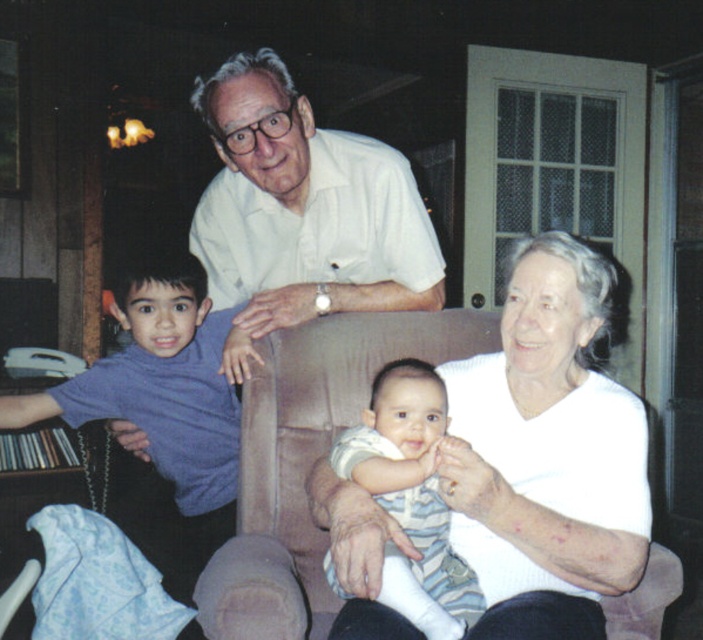
Is white ribbed sweater at center to the right of purple turtleneck shirt at left from the viewer's perspective?

Yes, white ribbed sweater at center is to the right of purple turtleneck shirt at left.

Describe the element at coordinates (546, 454) in the screenshot. I see `white ribbed sweater at center` at that location.

Between point (626, 426) and point (169, 404), which one is positioned in front?

Point (626, 426) is more forward.

Identify the location of white ribbed sweater at center. (546, 454).

Does purple turtleneck shirt at left appear on the left side of striped cotton onesie at center?

Yes, purple turtleneck shirt at left is to the left of striped cotton onesie at center.

Between purple turtleneck shirt at left and striped cotton onesie at center, which one has more height?

purple turtleneck shirt at left is taller.

The height and width of the screenshot is (640, 703). What do you see at coordinates (162, 397) in the screenshot?
I see `purple turtleneck shirt at left` at bounding box center [162, 397].

This screenshot has width=703, height=640. In order to click on purple turtleneck shirt at left in this screenshot , I will do `click(162, 397)`.

Which is above, white ribbed sweater at center or white smooth shirt at upper center?

white smooth shirt at upper center

Looking at this image, is white ribbed sweater at center to the right of white smooth shirt at upper center from the viewer's perspective?

Correct, you'll find white ribbed sweater at center to the right of white smooth shirt at upper center.

Between point (561, 609) and point (375, 193), which one is positioned behind?

The point (375, 193) is behind.

I want to click on white ribbed sweater at center, so coord(546,454).